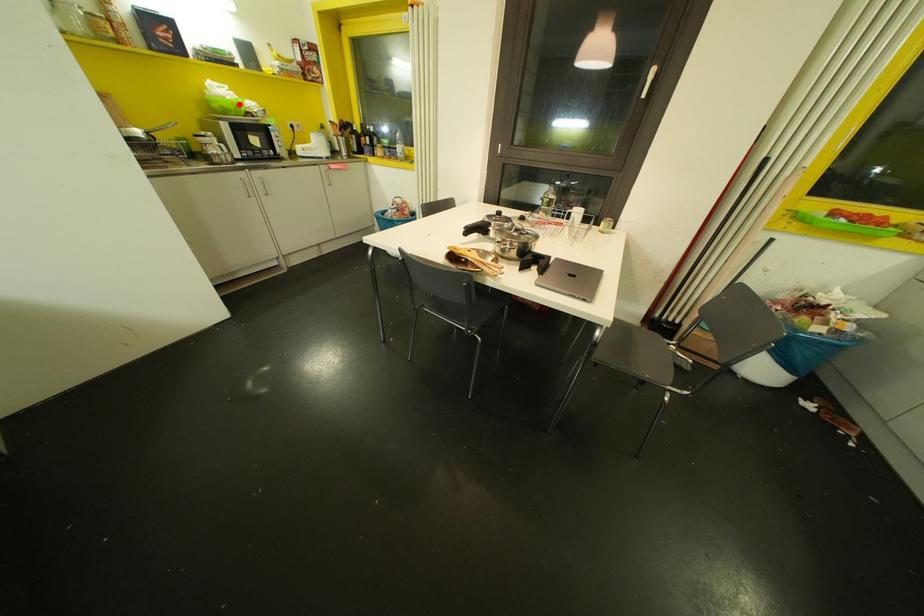
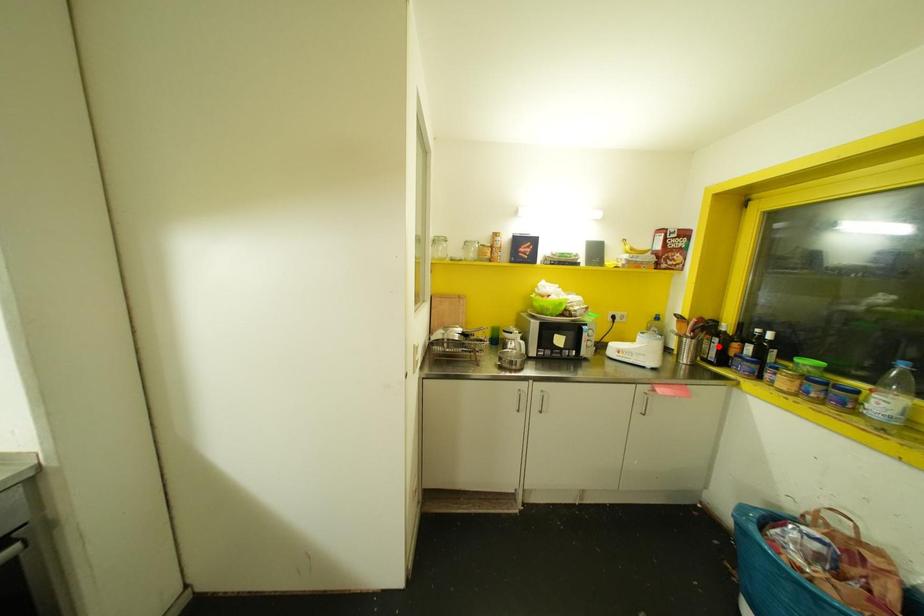
I am providing you with two images of the same scene from different viewpoints. A red point is marked on the first image and another point is marked on the second image. Do the highlighted points in image1 and image2 indicate the same real-world spot?

No